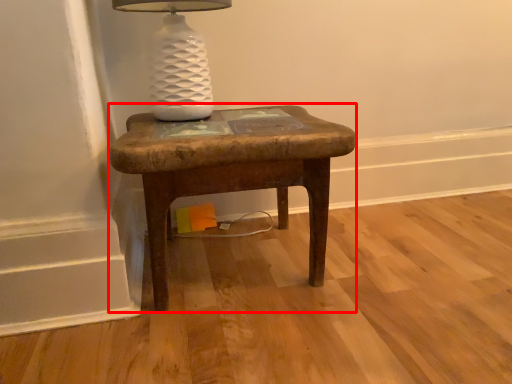
Question: In this image, where is stool (annotated by the red box) located relative to table lamp?

Choices:
 (A) left
 (B) right

Answer: (B)